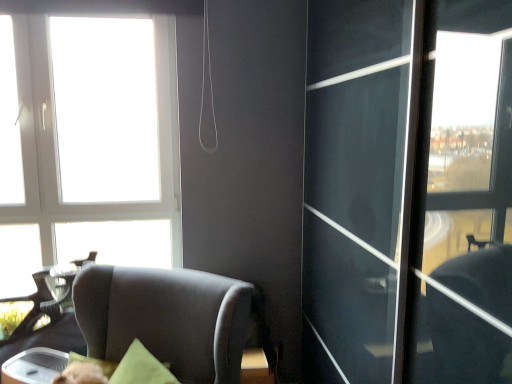
Question: In terms of width, does white plastic window at upper left look wider or thinner when compared to suede-like brown chair at lower left?

Choices:
 (A) thin
 (B) wide

Answer: (A)

Question: Is white plastic window at upper left in front of or behind suede-like brown chair at lower left in the image?

Choices:
 (A) front
 (B) behind

Answer: (B)

Question: Looking at the image, does white plastic window at upper left seem bigger or smaller compared to suede-like brown chair at lower left?

Choices:
 (A) small
 (B) big

Answer: (A)

Question: Choose the correct answer: Is suede-like brown chair at lower left inside white plastic window at upper left or outside it?

Choices:
 (A) outside
 (B) inside

Answer: (A)

Question: From the image's perspective, relative to white plastic window at upper left, is suede-like brown chair at lower left above or below?

Choices:
 (A) below
 (B) above

Answer: (A)

Question: Based on their sizes in the image, would you say suede-like brown chair at lower left is bigger or smaller than white plastic window at upper left?

Choices:
 (A) big
 (B) small

Answer: (A)

Question: Looking at their shapes, would you say suede-like brown chair at lower left is wider or thinner than white plastic window at upper left?

Choices:
 (A) wide
 (B) thin

Answer: (A)